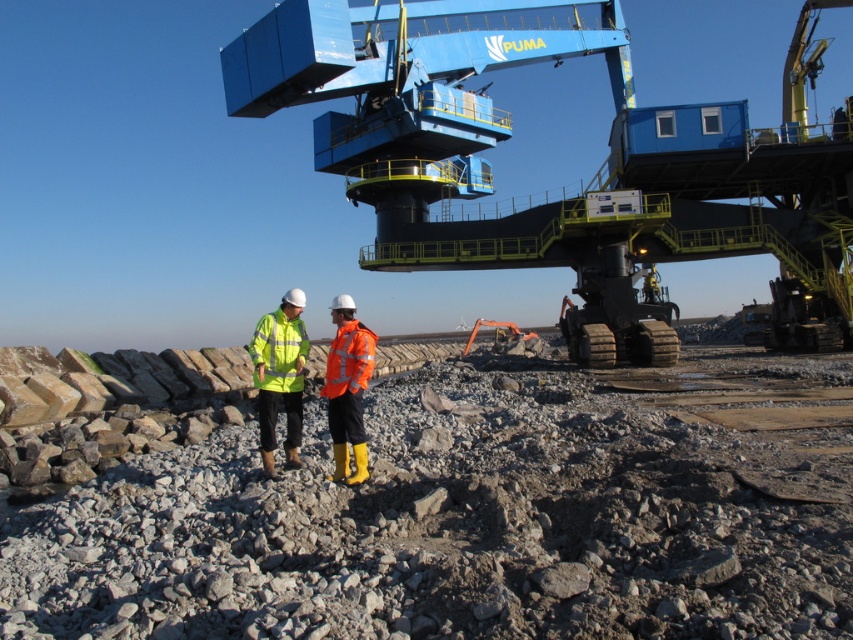
Is blue metallic crane at upper center shorter than high-visibility fabric jacket at center?

In fact, blue metallic crane at upper center may be taller than high-visibility fabric jacket at center.

Is blue metallic crane at upper center behind high-visibility fabric jacket at center?

Yes, it is.

Describe the element at coordinates (593, 177) in the screenshot. I see `blue metallic crane at upper center` at that location.

You are a GUI agent. You are given a task and a screenshot of the screen. Output one action in this format:
    pyautogui.click(x=<x>, y=<y>)
    Task: Click on the blue metallic crane at upper center
    Image resolution: width=853 pixels, height=640 pixels.
    Given the screenshot: What is the action you would take?
    pyautogui.click(x=593, y=177)

Who is lower down, blue metallic crane at upper center or orange reflective jacket at center?

orange reflective jacket at center

Is blue metallic crane at upper center positioned behind orange reflective jacket at center?

Yes, it is.

What do you see at coordinates (593, 177) in the screenshot? The width and height of the screenshot is (853, 640). I see `blue metallic crane at upper center` at bounding box center [593, 177].

Locate an element on the screen. This screenshot has width=853, height=640. blue metallic crane at upper center is located at coordinates (593, 177).

Can you confirm if high-visibility fabric jacket at center is positioned below orange reflective jacket at center?

No.

Who is positioned more to the left, high-visibility fabric jacket at center or orange reflective jacket at center?

high-visibility fabric jacket at center is more to the left.

At what (x,y) coordinates should I click in order to perform the action: click on high-visibility fabric jacket at center. Please return your answer as a coordinate pair (x, y). Image resolution: width=853 pixels, height=640 pixels. Looking at the image, I should click on (280, 376).